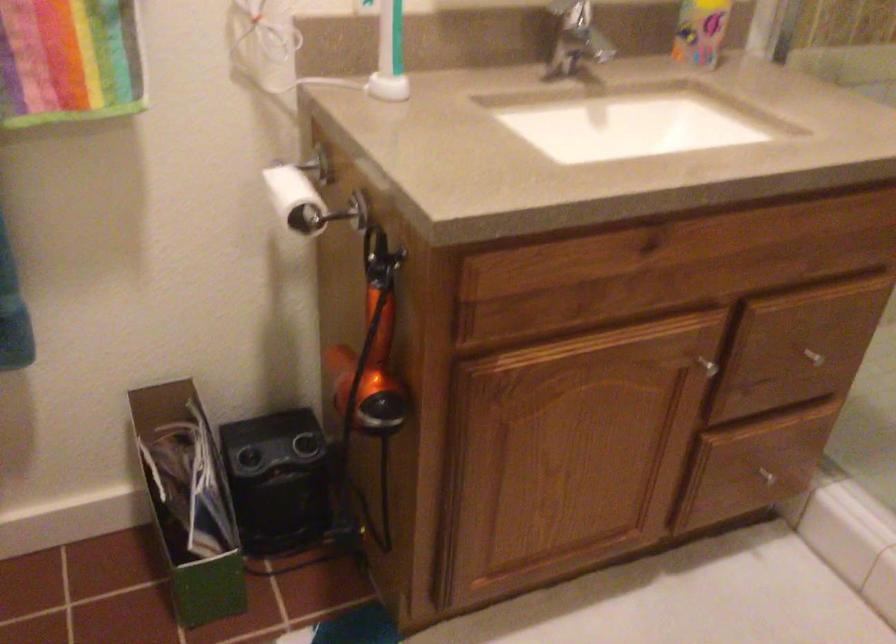
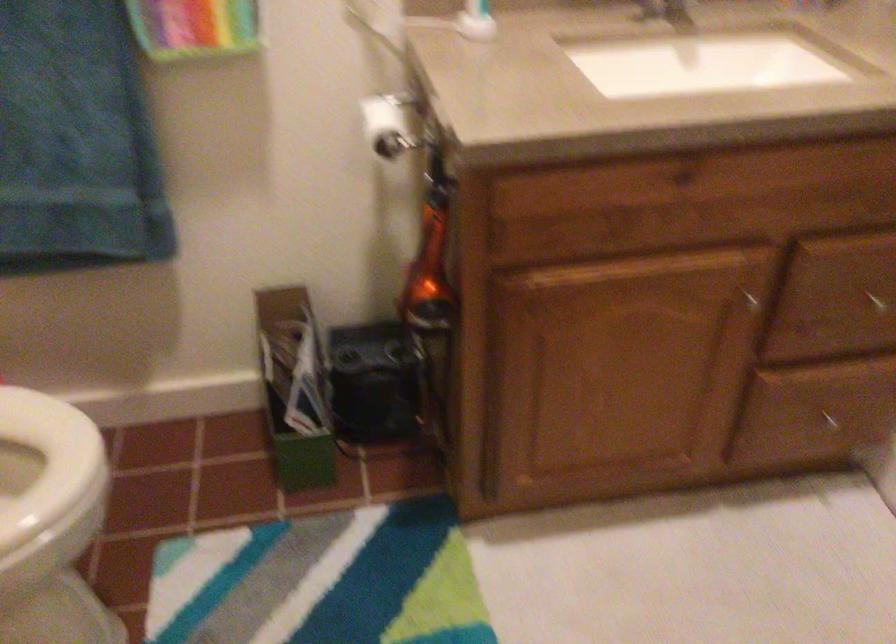
In the second image, find the point that corresponds to (808,354) in the first image.

(875, 301)